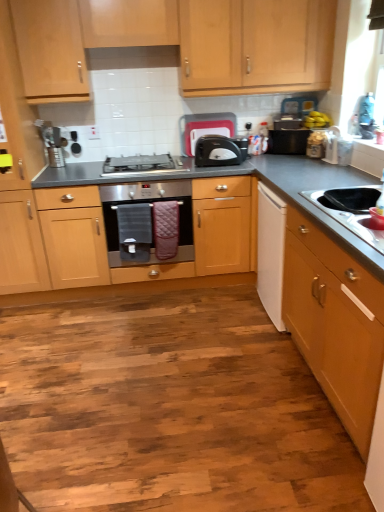
Identify the location of vacant space underneath satin black toaster at center (from a real-world perspective). (229, 161).